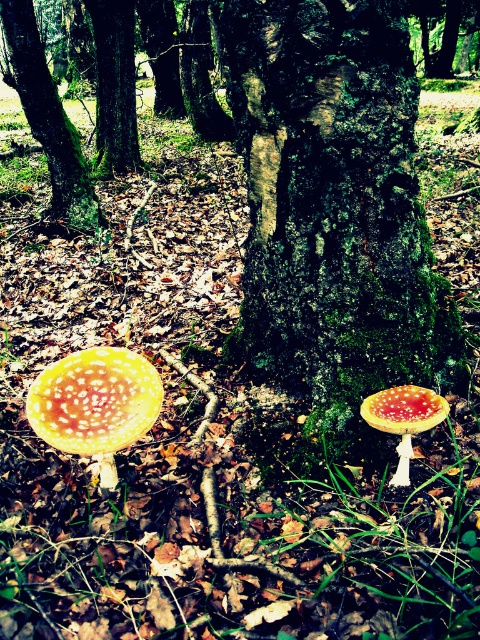
Does yellow spotted mushroom at lower left appear over yellow spotted mushroom at lower center?

Correct, yellow spotted mushroom at lower left is located above yellow spotted mushroom at lower center.

From the picture: Between yellow spotted mushroom at lower left and yellow spotted mushroom at lower center, which one is positioned higher?

yellow spotted mushroom at lower left is higher up.

Does point (152, 365) come in front of point (406, 465)?

No, (152, 365) is behind (406, 465).

Identify the location of yellow spotted mushroom at lower left. The image size is (480, 640). (95, 401).

Between point (104, 452) and point (4, 68), which one is positioned in front?

Point (104, 452)

This screenshot has width=480, height=640. What do you see at coordinates (95, 401) in the screenshot?
I see `yellow spotted mushroom at lower left` at bounding box center [95, 401].

Which is in front, point (84, 452) or point (68, 214)?

Point (84, 452) is in front.

Find the location of a particular element. yellow spotted mushroom at lower left is located at coordinates (95, 401).

The width and height of the screenshot is (480, 640). What do you see at coordinates (47, 116) in the screenshot? I see `green mossy tree at center` at bounding box center [47, 116].

Which of these two, green mossy tree at center or yellow spotted mushroom at lower center, stands taller?

With more height is green mossy tree at center.

Which is behind, point (70, 220) or point (403, 387)?

The point (70, 220) is more distant.

Find the location of `green mossy tree at center`. green mossy tree at center is located at coordinates (47, 116).